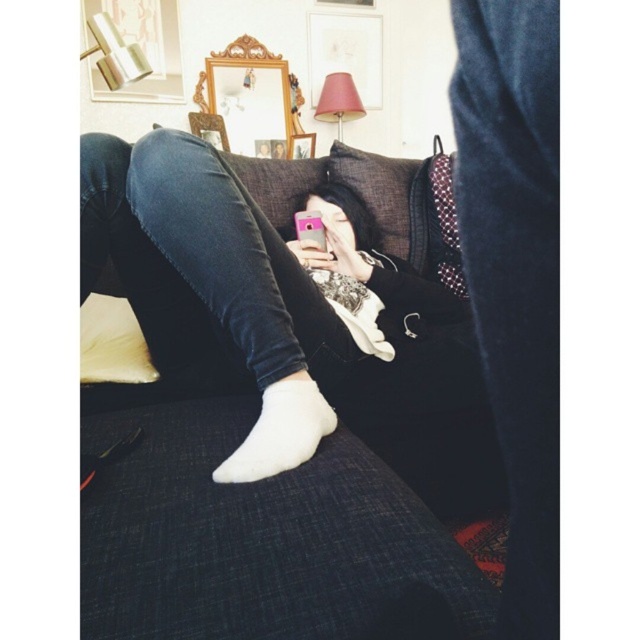
Question: Estimate the real-world distances between objects in this image. Which object is farther from the white fabric pillow at left?

Choices:
 (A) white cotton sock at lower center
 (B) dark fabric couch at center
 (C) velvet dark blue pants at lower right

Answer: (C)

Question: Which of the following is the farthest from the observer?

Choices:
 (A) dark fabric couch at center
 (B) white cotton sock at lower center
 (C) velvet dark blue pants at lower right

Answer: (B)

Question: Is dark fabric couch at center thinner than velvet dark blue pants at lower right?

Choices:
 (A) no
 (B) yes

Answer: (A)

Question: Is the position of velvet dark blue pants at lower right more distant than that of white fabric pillow at left?

Choices:
 (A) no
 (B) yes

Answer: (A)

Question: Is dark fabric couch at center to the left of white fabric pillow at left from the viewer's perspective?

Choices:
 (A) no
 (B) yes

Answer: (A)

Question: Which point appears farthest from the camera in this image?

Choices:
 (A) (184, 346)
 (B) (266, 397)

Answer: (A)